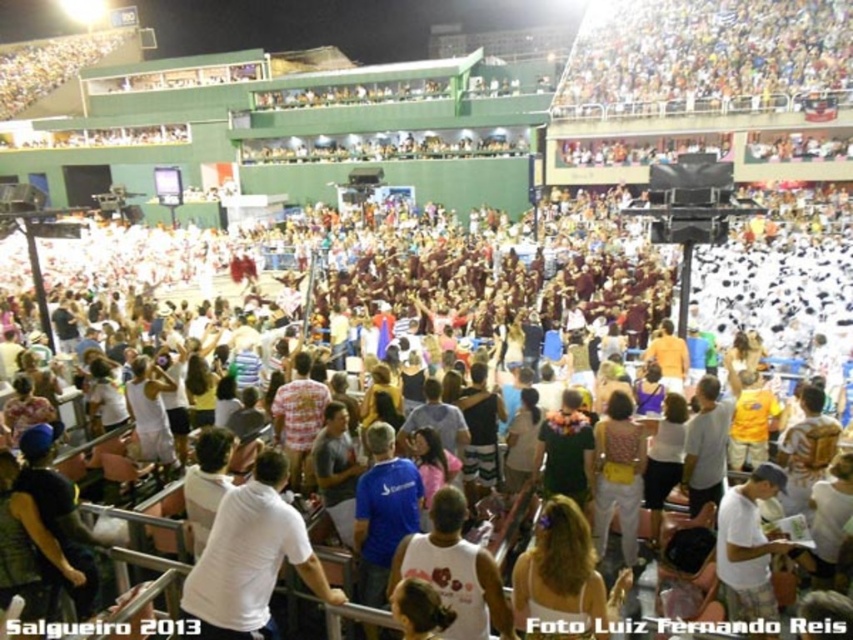
You are a photographer at the event and want to capture both the white matte shirt at center and the white cotton shirt at center in a single photo. Which shirt should you focus on first to ensure the one in the background is also in focus?

The white matte shirt at center is above the white cotton shirt at center, so you should focus on the white cotton shirt at center first since it is lower and farther away, ensuring both are in focus.

You are a photographer at the event and want to capture both the white matte shirt at center and the white cotton shirt at center in a single photo. Which shirt should you focus on first to ensure both are in frame?

The white matte shirt at center is larger in size than the white cotton shirt at center, so focusing on the white matte shirt at center first will ensure both shirts are in frame since it occupies more space and can help frame the composition.

You are a photographer at the event and want to take a photo of both the white matte shirt at center and the white cotton shirt at center. Which one will be more visible in the photo due to its height?

The white matte shirt at center is much taller than the white cotton shirt at center, so it will be more visible in the photo due to its height.